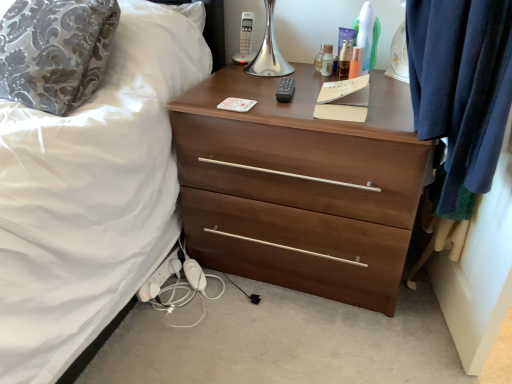
Question: From the image's perspective, does black plastic remote at center appear higher than clear plastic bottle at upper center, positioned as the 1th toiletry in left-to-right order?

Choices:
 (A) yes
 (B) no

Answer: (B)

Question: Does black plastic remote at center have a larger size compared to clear plastic bottle at upper center, positioned as the 1th toiletry in left-to-right order?

Choices:
 (A) no
 (B) yes

Answer: (B)

Question: Is black plastic remote at center to the left of clear plastic bottle at upper center, positioned as the 1th toiletry in left-to-right order, from the viewer's perspective?

Choices:
 (A) no
 (B) yes

Answer: (B)

Question: From a real-world perspective, is black plastic remote at center physically below clear plastic bottle at upper center, placed as the 4th toiletry when sorted from right to left?

Choices:
 (A) no
 (B) yes

Answer: (B)

Question: Is black plastic remote at center thinner than clear plastic bottle at upper center, positioned as the 1th toiletry in left-to-right order?

Choices:
 (A) no
 (B) yes

Answer: (A)

Question: Would you say brown wood chest of drawers at center is to the left or to the right of clear plastic bottle at upper center, placed as the 4th toiletry when sorted from right to left, in the picture?

Choices:
 (A) right
 (B) left

Answer: (B)

Question: From the image's perspective, is brown wood chest of drawers at center above or below clear plastic bottle at upper center, placed as the 4th toiletry when sorted from right to left?

Choices:
 (A) below
 (B) above

Answer: (A)

Question: Is brown wood chest of drawers at center inside or outside of clear plastic bottle at upper center, positioned as the 1th toiletry in left-to-right order?

Choices:
 (A) inside
 (B) outside

Answer: (B)

Question: Is point (293, 173) positioned closer to the camera than point (322, 56)?

Choices:
 (A) farther
 (B) closer

Answer: (B)

Question: Is translucent plastic bottles at upper right, which is the 2th toiletry in right-to-left order, wider or thinner than white plastic extension cord at lower left?

Choices:
 (A) thin
 (B) wide

Answer: (A)

Question: Is point (346, 44) closer or farther from the camera than point (179, 259)?

Choices:
 (A) closer
 (B) farther

Answer: (A)

Question: Choose the correct answer: Is translucent plastic bottles at upper right, the 3th toiletry in the left-to-right sequence, inside white plastic extension cord at lower left or outside it?

Choices:
 (A) inside
 (B) outside

Answer: (B)

Question: Is translucent plastic bottles at upper right, which is the 2th toiletry in right-to-left order, taller or shorter than white plastic extension cord at lower left?

Choices:
 (A) short
 (B) tall

Answer: (B)

Question: Considering their positions, is white plastic extension cord at lower left located in front of or behind clear plastic bottle at upper center, the third toiletry viewed from the right?

Choices:
 (A) front
 (B) behind

Answer: (A)

Question: From a real-world perspective, is white plastic extension cord at lower left positioned above or below clear plastic bottle at upper center, the third toiletry viewed from the right?

Choices:
 (A) above
 (B) below

Answer: (B)